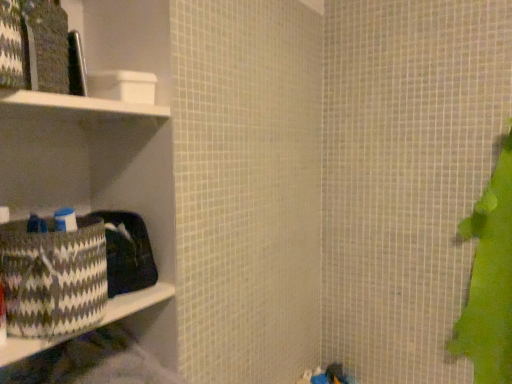
Measure the distance between patterned woven basket at left and camera.

patterned woven basket at left and camera are 25.16 inches apart.

Locate an element on the screen. This screenshot has width=512, height=384. patterned fabric basket at left is located at coordinates (136, 302).

The width and height of the screenshot is (512, 384). In order to click on patterned woven basket at left in this screenshot , I will do `click(53, 277)`.

Does point (76, 333) come in front of point (110, 100)?

Yes.

What's the angular difference between patterned fabric basket at left and white matte cabinet at upper left's facing directions?

0.192 degrees separate the facing orientations of patterned fabric basket at left and white matte cabinet at upper left.

From the image's perspective, which is above, patterned fabric basket at left or white matte cabinet at upper left?

white matte cabinet at upper left appears higher in the image.

Who is shorter, patterned fabric basket at left or patterned woven basket at left?

patterned fabric basket at left is shorter.

From the image's perspective, does patterned fabric basket at left appear higher than patterned woven basket at left?

No.

Is patterned fabric basket at left to the left of patterned woven basket at left from the viewer's perspective?

Correct, you'll find patterned fabric basket at left to the left of patterned woven basket at left.

Does point (132, 107) appear closer or farther from the camera than point (68, 336)?

Point (132, 107).

From a real-world perspective, is white matte cabinet at upper left on patterned fabric basket at left?

Yes, from a real-world perspective, white matte cabinet at upper left is above patterned fabric basket at left.

Does white matte cabinet at upper left turn towards patterned fabric basket at left?

No, white matte cabinet at upper left is not turned towards patterned fabric basket at left.

Is white matte cabinet at upper left thinner than patterned fabric basket at left?

Yes.

How many degrees apart are the facing directions of white matte cabinet at upper left and patterned woven basket at left?

0.598 degrees.

Is white matte cabinet at upper left wider than patterned woven basket at left?

Yes, white matte cabinet at upper left is wider than patterned woven basket at left.

Is white matte cabinet at upper left directly adjacent to patterned woven basket at left?

No, white matte cabinet at upper left is not touching patterned woven basket at left.

Is patterned woven basket at left turned away from white matte cabinet at upper left?

That's not correct — patterned woven basket at left is not looking away from white matte cabinet at upper left.

Which is in front, point (79, 309) or point (131, 102)?

The point (79, 309) is closer to the camera.

Between patterned woven basket at left and patterned fabric basket at left, which one is positioned in front?

patterned woven basket at left is more forward.

From a real-world perspective, relative to patterned fabric basket at left, is patterned woven basket at left vertically above or below?

patterned woven basket at left is above patterned fabric basket at left.

Which of these two, patterned woven basket at left or patterned fabric basket at left, is thinner?

patterned woven basket at left.

Measure the distance between patterned woven basket at left and patterned fabric basket at left.

patterned woven basket at left is 3.31 inches away from patterned fabric basket at left.

This screenshot has height=384, width=512. Find the location of `ledge on the left of white matte cabinet at upper left`. ledge on the left of white matte cabinet at upper left is located at coordinates coord(136,302).

Find the location of `ledge below the patterned woven basket at left (from the image's perspective)`. ledge below the patterned woven basket at left (from the image's perspective) is located at coordinates (136, 302).

Considering their positions, is patterned fabric basket at left positioned closer to patterned woven basket at left than white matte cabinet at upper left?

Based on the image, patterned fabric basket at left appears to be nearer to patterned woven basket at left.

Based on their spatial positions, is white matte cabinet at upper left or patterned woven basket at left further from patterned fabric basket at left?

The object further to patterned fabric basket at left is white matte cabinet at upper left.

Based on their spatial positions, is white matte cabinet at upper left or patterned fabric basket at left further from patterned woven basket at left?

white matte cabinet at upper left is positioned further to the anchor patterned woven basket at left.

When comparing their distances from patterned fabric basket at left, does patterned woven basket at left or white matte cabinet at upper left seem closer?

Based on the image, patterned woven basket at left appears to be nearer to patterned fabric basket at left.

Looking at the image, which one is located further to white matte cabinet at upper left, patterned woven basket at left or patterned fabric basket at left?

Among the two, patterned fabric basket at left is located further to white matte cabinet at upper left.

Considering their positions, is patterned fabric basket at left positioned further to white matte cabinet at upper left than patterned woven basket at left?

Based on the image, patterned fabric basket at left appears to be further to white matte cabinet at upper left.

Where is `waste between white matte cabinet at upper left and patterned fabric basket at left from top to bottom`? The image size is (512, 384). waste between white matte cabinet at upper left and patterned fabric basket at left from top to bottom is located at coordinates (53, 277).